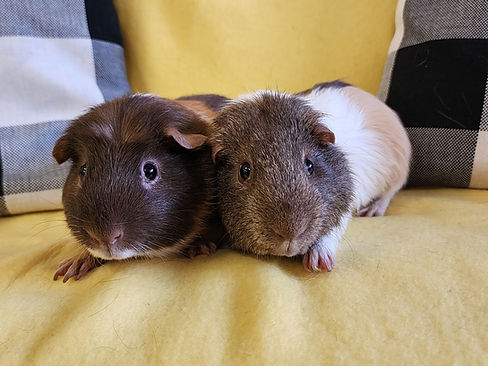
Locate an element on the screen. The height and width of the screenshot is (366, 488). yellow cloth surface is located at coordinates (16, 275), (33, 316), (200, 315), (331, 305), (445, 236), (216, 65), (193, 20), (327, 13).